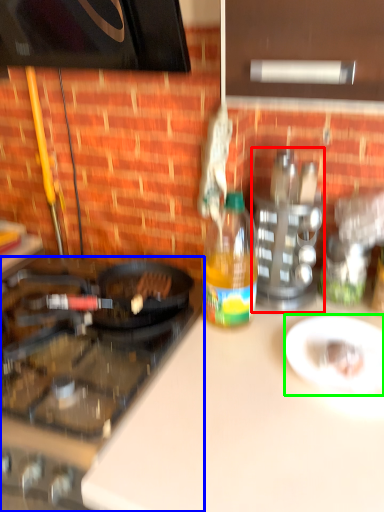
Question: Which is nearer to the appliance (highlighted by a red box)? gas stove (highlighted by a blue box) or plate (highlighted by a green box).

Choices:
 (A) gas stove
 (B) plate

Answer: (B)